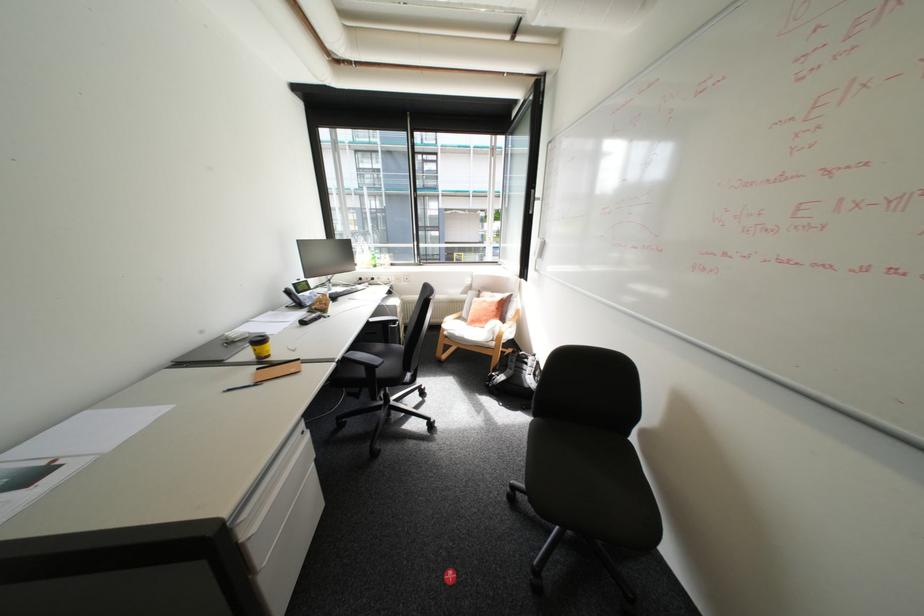
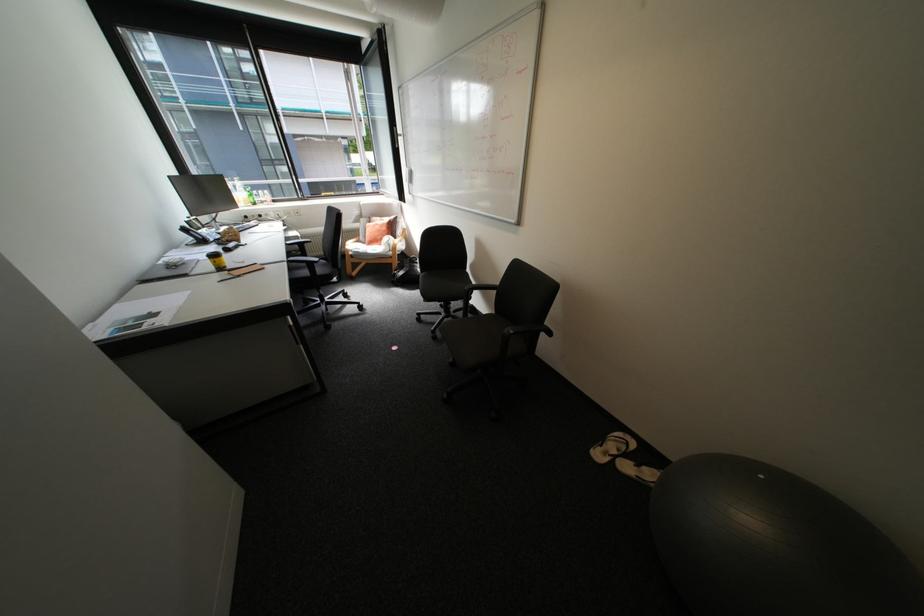
In the second image, find the point that corresponds to (x=256, y=353) in the first image.

(217, 265)